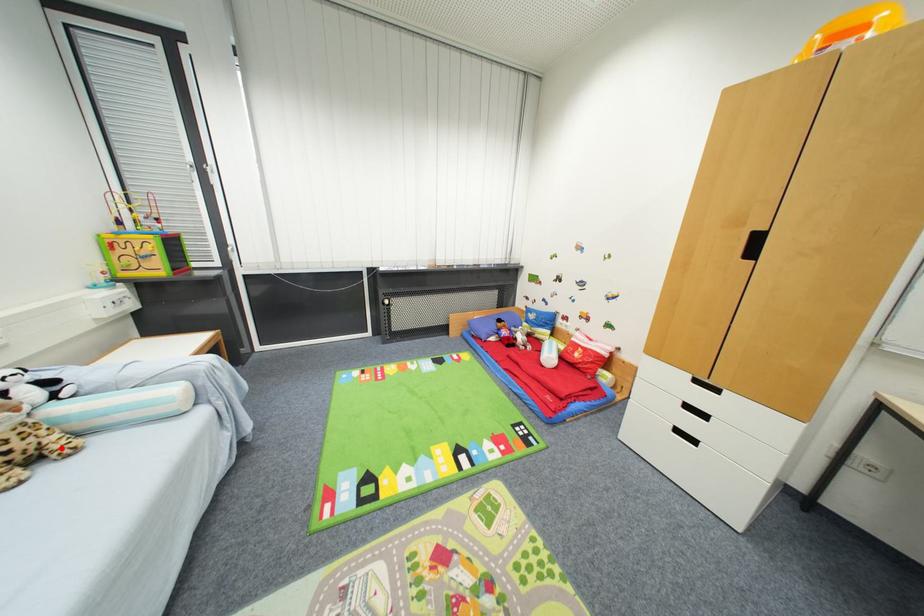
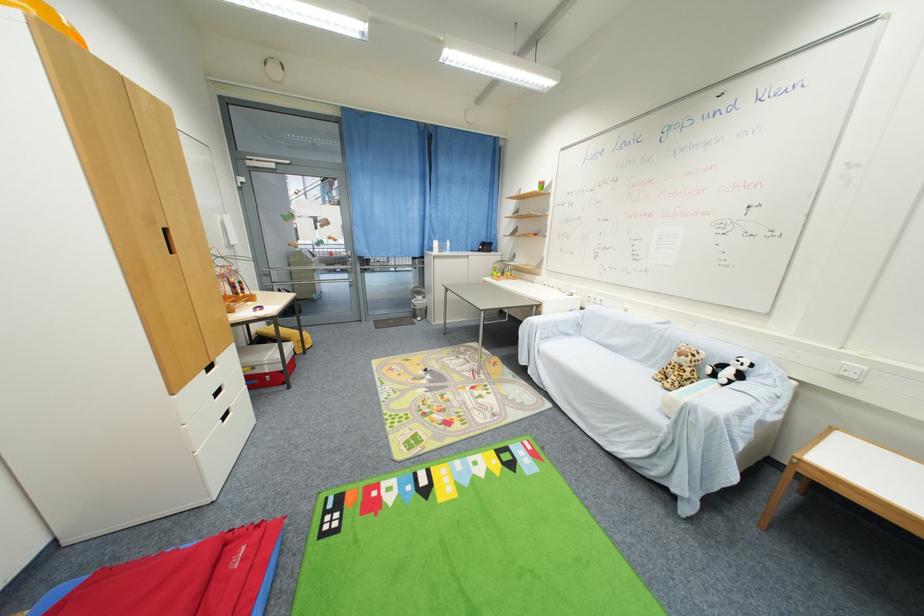
Where in the second image is the point corresponding to the highlighted location from the first image?

(675, 382)